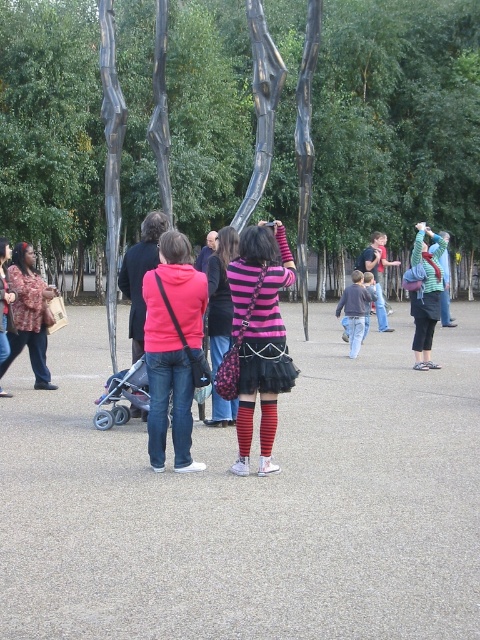
Based on the scene description, where is the pink striped sweater at center located in terms of its 2D coordinates?

The pink striped sweater at center is located at the 2D coordinates of point (261, 337).

You are standing at the center of the park and see the point marked at coordinates (172, 348). What object is located at that point?

The pink fleece jacket at center is located at point (172, 348).